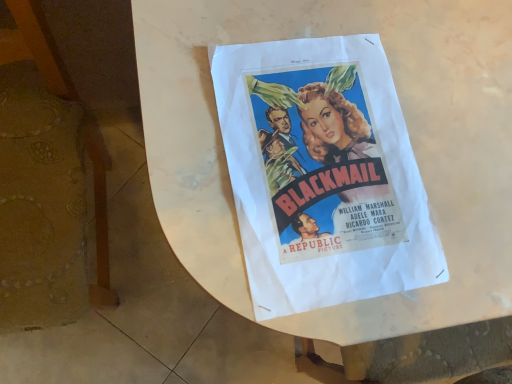
Where is `vacant region below matte paper poster at center (from a real-world perspective)`? This screenshot has width=512, height=384. vacant region below matte paper poster at center (from a real-world perspective) is located at coordinates (318, 161).